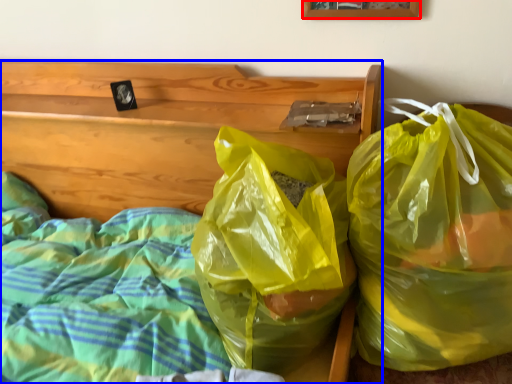
Question: Which point is closer to the camera, picture frame (highlighted by a red box) or furniture (highlighted by a blue box)?

Choices:
 (A) picture frame
 (B) furniture

Answer: (B)